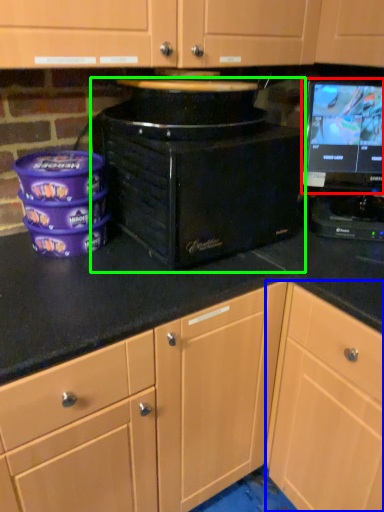
Question: Based on their relative distances, which object is farther from computer monitor (highlighted by a red box)? Choose from cabinetry (highlighted by a blue box) and home appliance (highlighted by a green box).

Choices:
 (A) cabinetry
 (B) home appliance

Answer: (A)